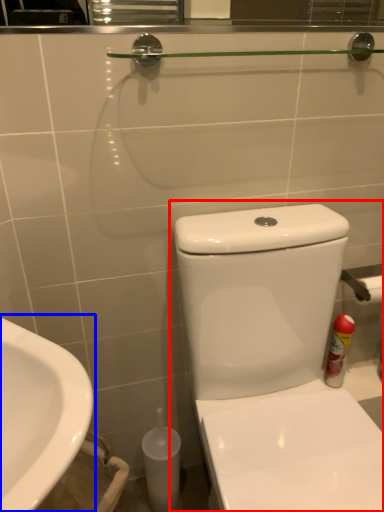
Question: Which object appears closest to the camera in this image, toilet (highlighted by a red box) or sink (highlighted by a blue box)?

Choices:
 (A) toilet
 (B) sink

Answer: (A)